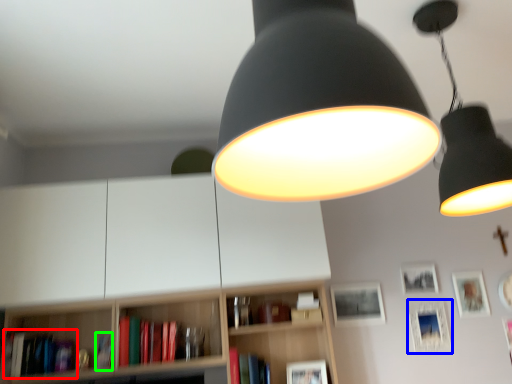
Question: Estimate the real-world distances between objects in this image. Which object is farther from book (highlighted by a red box), picture frame (highlighted by a blue box) or book (highlighted by a green box)?

Choices:
 (A) picture frame
 (B) book

Answer: (A)